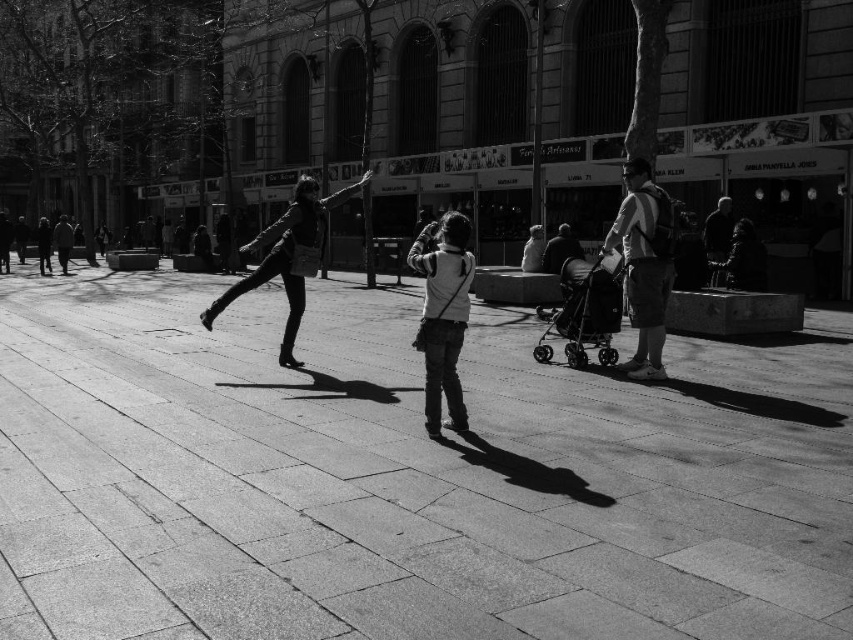
Question: Can you confirm if smooth concrete pavement at center is positioned below metallic stroller at center-right?

Choices:
 (A) yes
 (B) no

Answer: (A)

Question: Which of these objects is positioned closest to the denim pants at center?

Choices:
 (A) matte gray backpack at right
 (B) matte black jacket at center
 (C) metallic stroller at center-right
 (D) smooth concrete pavement at center

Answer: (A)

Question: Which object is the farthest from the denim pants at center?

Choices:
 (A) matte gray backpack at right
 (B) matte black jacket at center
 (C) metallic stroller at center-right
 (D) smooth concrete pavement at center

Answer: (B)

Question: Is matte gray backpack at right smaller than matte black jacket at center?

Choices:
 (A) yes
 (B) no

Answer: (A)

Question: Is smooth concrete pavement at center positioned at the back of denim pants at center?

Choices:
 (A) yes
 (B) no

Answer: (B)

Question: Estimate the real-world distances between objects in this image. Which object is farther from the denim pants at center?

Choices:
 (A) matte gray backpack at right
 (B) smooth concrete pavement at center
 (C) metallic stroller at center-right
 (D) matte black jacket at center

Answer: (D)